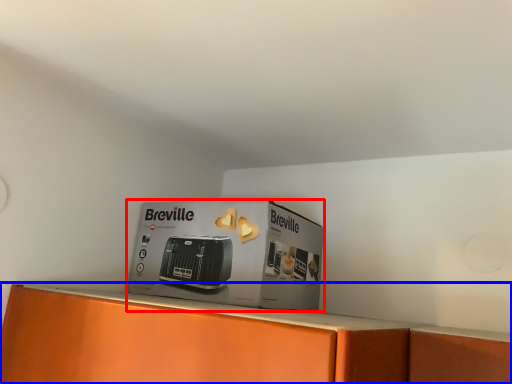
Question: Among these objects, which one is nearest to the camera, cardboard box (highlighted by a red box) or home appliance (highlighted by a blue box)?

Choices:
 (A) cardboard box
 (B) home appliance

Answer: (A)